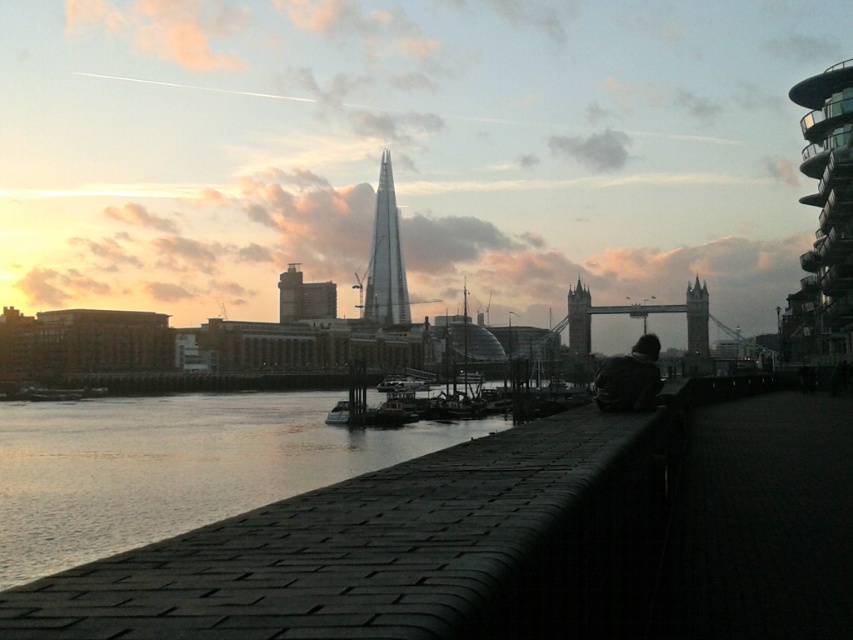
Question: Can you confirm if stone gray tower at center is positioned below metallic silver boat at center?

Choices:
 (A) yes
 (B) no

Answer: (B)

Question: Which point is closer to the camera?

Choices:
 (A) (820, 81)
 (B) (689, 282)

Answer: (A)

Question: Is smooth concrete river at lower left further to the viewer compared to metallic silver boat at center?

Choices:
 (A) yes
 (B) no

Answer: (B)

Question: In this image, where is red brick building at center located relative to stone gray tower at center?

Choices:
 (A) right
 (B) left

Answer: (B)

Question: Which point is farther to the camera?

Choices:
 (A) glassy transparent building at upper right
 (B) stone tower at center
 (C) smooth concrete river at lower left

Answer: (B)

Question: Which point is farther to the camera?

Choices:
 (A) stone tower at center
 (B) metallic silver boat at center
 (C) red brick building at center
 (D) glassy steel tower at center

Answer: (D)